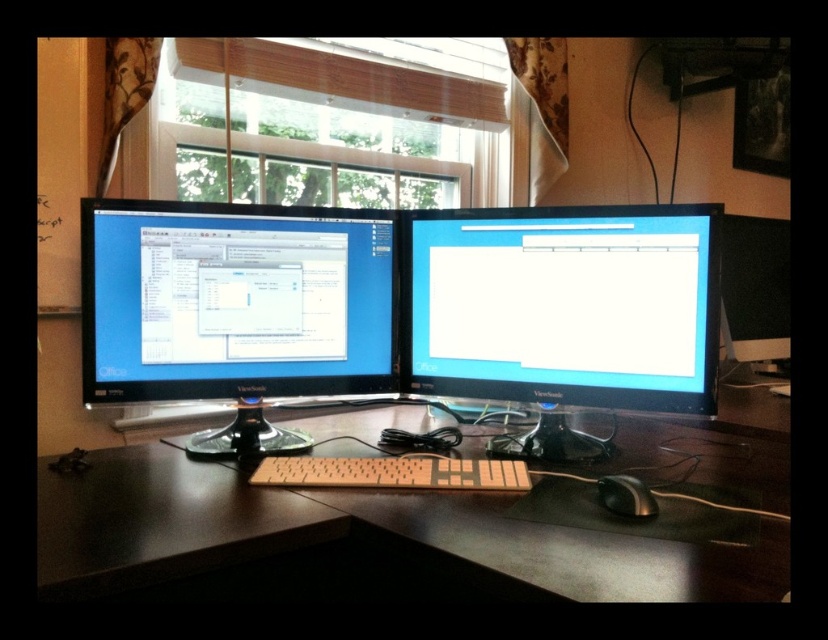
Question: Which is nearer to the matte black monitor at center?

Choices:
 (A) black plastic mouse at lower right
 (B) black glossy monitor at right
 (C) white matte keyboard at center
 (D) satin black monitor at center

Answer: (D)

Question: Can you confirm if black matte computer desk at center is positioned above matte black monitor at center?

Choices:
 (A) no
 (B) yes

Answer: (A)

Question: Among these objects, which one is farthest from the camera?

Choices:
 (A) matte black monitor at center
 (B) black glossy monitor at right
 (C) black plastic mouse at lower right

Answer: (B)

Question: Does satin black monitor at center appear on the left side of black glossy monitor at right?

Choices:
 (A) no
 (B) yes

Answer: (B)

Question: Which of the following is the closest to the observer?

Choices:
 (A) (431, 216)
 (B) (383, 458)
 (C) (258, 554)

Answer: (C)

Question: Is matte black monitor at center thinner than white matte keyboard at center?

Choices:
 (A) yes
 (B) no

Answer: (B)